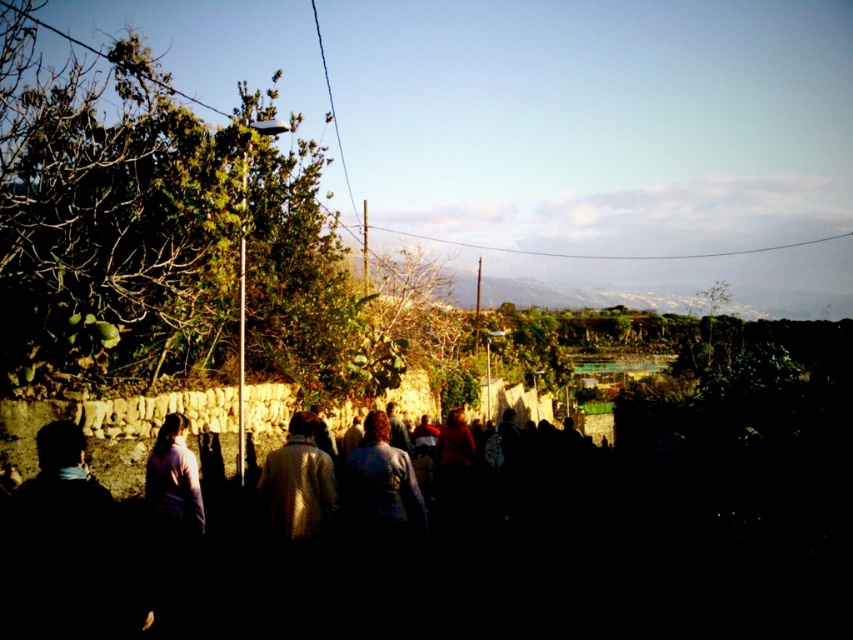
Question: Estimate the real-world distances between objects in this image. Which object is closer to the light purple sweater at center?

Choices:
 (A) shiny metallic jacket at center
 (B) blue fabric jacket at center

Answer: (A)

Question: Which object is closer to the camera taking this photo?

Choices:
 (A) light purple sweater at center
 (B) blue fabric jacket at center
 (C) shiny metallic jacket at center

Answer: (B)

Question: Is shiny metallic jacket at center positioned behind light purple sweater at center?

Choices:
 (A) yes
 (B) no

Answer: (B)

Question: Does shiny metallic jacket at center appear on the right side of light purple sweater at center?

Choices:
 (A) yes
 (B) no

Answer: (A)

Question: Among these objects, which one is nearest to the camera?

Choices:
 (A) blue fabric jacket at center
 (B) light purple sweater at center

Answer: (A)

Question: Is blue fabric jacket at center in front of light purple sweater at center?

Choices:
 (A) no
 (B) yes

Answer: (B)